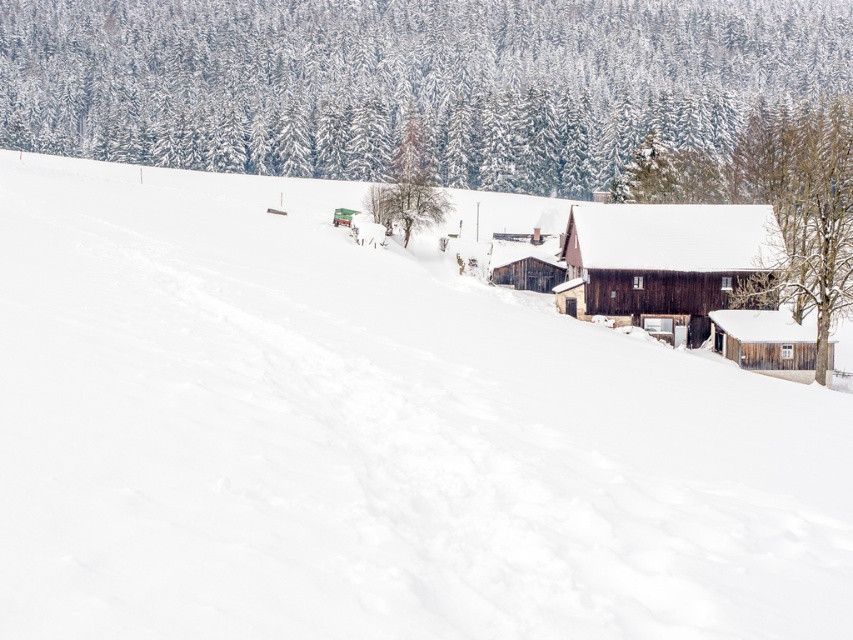
Question: Is green textured tree at upper center below bare wood tree at center?

Choices:
 (A) no
 (B) yes

Answer: (B)

Question: Estimate the real-world distances between objects in this image. Which object is closer to the brown wooden cabin at center?

Choices:
 (A) wooden cabin at right
 (B) bare wood tree at center

Answer: (A)

Question: Which object is positioned closest to the wooden cabin at right?

Choices:
 (A) snow-covered wooden tree at lower right
 (B) brown wooden cabin at center
 (C) bare wood tree at center
 (D) green textured tree at upper center

Answer: (B)

Question: Which object is positioned farthest from the snow-covered wooden tree at lower right?

Choices:
 (A) bare wood tree at center
 (B) snow-covered evergreen at upper center
 (C) green textured tree at upper center

Answer: (B)

Question: Is snow-covered evergreen at upper center positioned before wooden cabin at right?

Choices:
 (A) no
 (B) yes

Answer: (A)

Question: Is snow-covered evergreen at upper center thinner than wooden cabin at right?

Choices:
 (A) yes
 (B) no

Answer: (B)